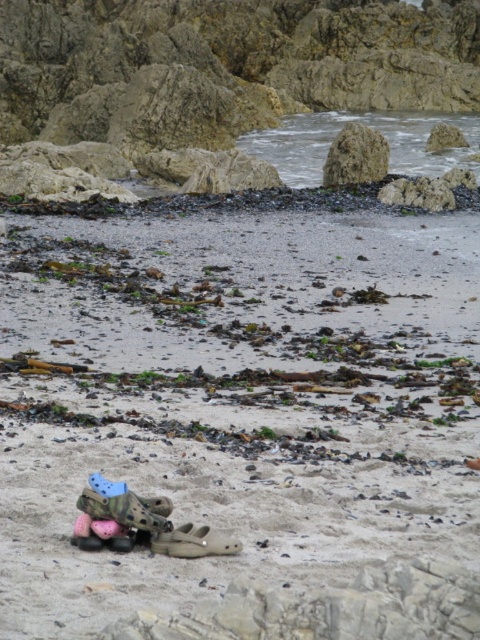
Can you confirm if crocodile-patterned rubber sandal at lower center is positioned below tan suede shoe at center?

Incorrect, crocodile-patterned rubber sandal at lower center is not positioned below tan suede shoe at center.

Looking at this image, who is higher up, crocodile-patterned rubber sandal at lower center or tan suede shoe at center?

Positioned higher is crocodile-patterned rubber sandal at lower center.

Is point (109, 499) behind point (216, 545)?

Yes, it is behind point (216, 545).

This screenshot has width=480, height=640. Find the location of `crocodile-patterned rubber sandal at lower center`. crocodile-patterned rubber sandal at lower center is located at coordinates (128, 509).

Which of these two, brown rough rock at upper center or tan suede shoe at center, stands taller?

brown rough rock at upper center

Is brown rough rock at upper center shorter than tan suede shoe at center?

No.

Does point (373, 163) come farther from viewer compared to point (176, 545)?

Yes, point (373, 163) is behind point (176, 545).

The height and width of the screenshot is (640, 480). Find the location of `brown rough rock at upper center`. brown rough rock at upper center is located at coordinates (356, 156).

Is brown rough rock at upper center thinner than crocodile-patterned rubber sandal at lower center?

No.

Which is in front, point (345, 129) or point (149, 497)?

Point (149, 497) is in front.

At what (x,y) coordinates should I click in order to perform the action: click on brown rough rock at upper center. Please return your answer as a coordinate pair (x, y). Looking at the image, I should click on (356, 156).